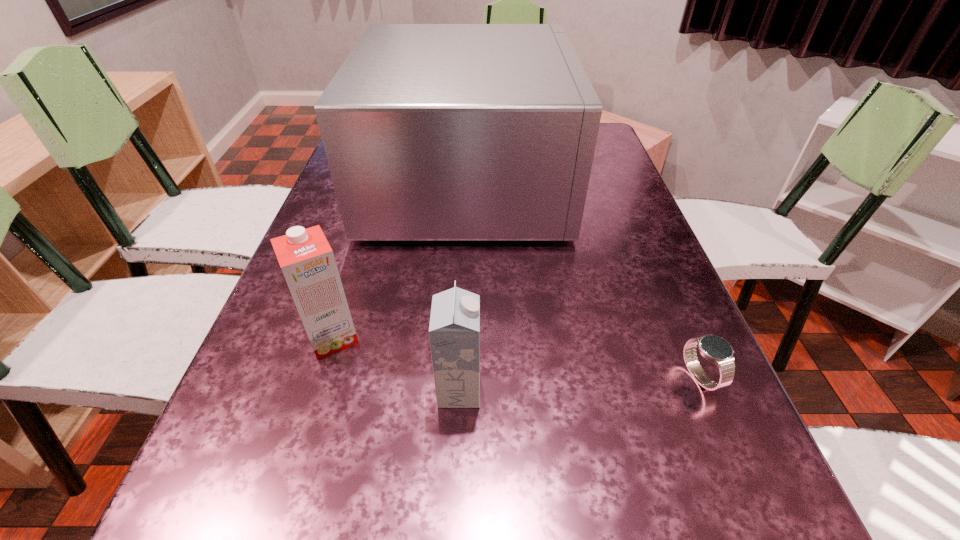
Identify the location of the tallest object. (433, 132).

Find the location of a particular element. The height and width of the screenshot is (540, 960). microwave oven is located at coordinates (433, 132).

Locate an element on the screen. the left carton is located at coordinates (306, 259).

Where is `the right carton`? Image resolution: width=960 pixels, height=540 pixels. the right carton is located at coordinates (454, 331).

Find the location of a particular element. the rightmost object is located at coordinates (713, 348).

Locate an element on the screen. This screenshot has width=960, height=540. the shortest object is located at coordinates (713, 348).

Where is `free space located 0.180m with the door open on the farthest object`? The image size is (960, 540). free space located 0.180m with the door open on the farthest object is located at coordinates (629, 181).

The image size is (960, 540). In order to click on free space located 0.080m on the front of the farther carton in this screenshot , I will do `click(313, 399)`.

Where is `vacant space situated 0.260m on the front label of the nearer carton`? This screenshot has height=540, width=960. vacant space situated 0.260m on the front label of the nearer carton is located at coordinates (633, 390).

Find the location of `free space located on the left of the shortest object`. free space located on the left of the shortest object is located at coordinates (547, 377).